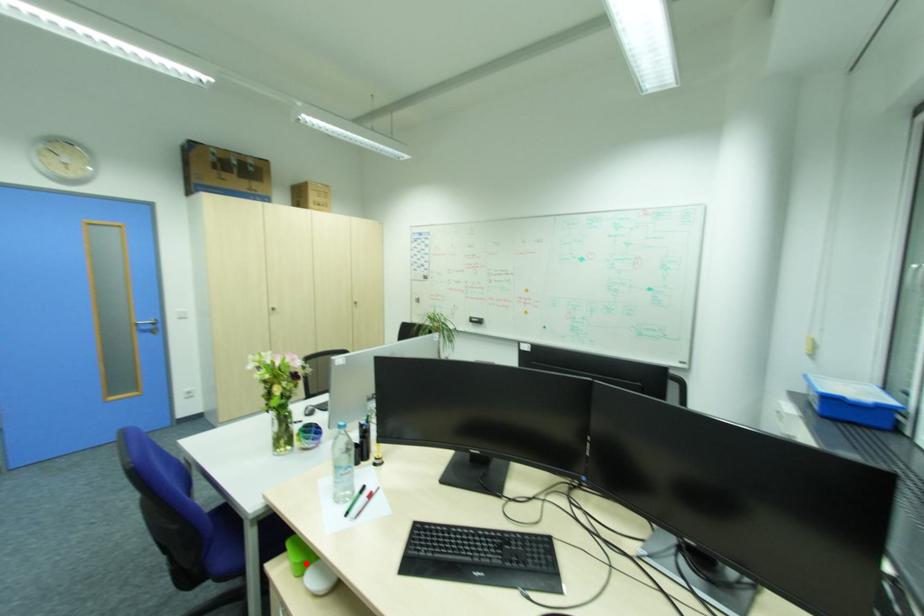
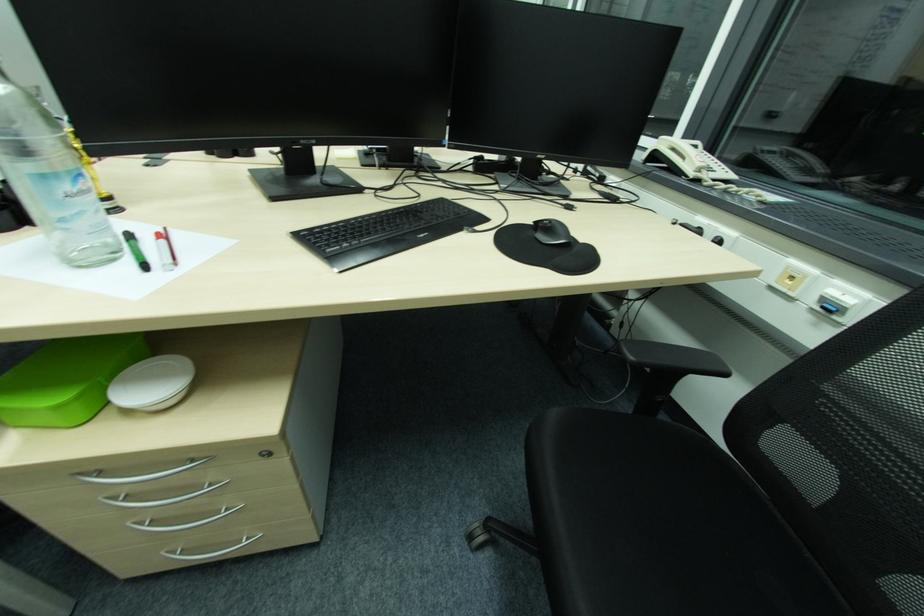
Where in the second image is the point corresponding to the highlighted location from the first image?

(84, 395)